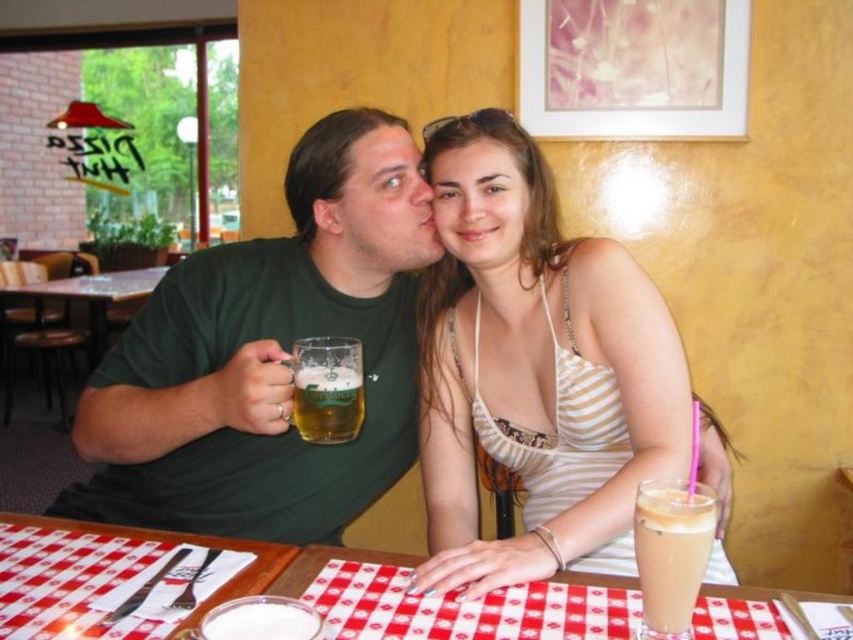
You are a photographer taking a photo of the scene. You want to focus on the green matte shirt at left and the white striped tank top at center. Which one is positioned lower in the frame?

The green matte shirt at left is located below the white striped tank top at center, so it is positioned lower in the frame.

You are a photographer trying to capture the couple in the scene. You need to place a small decorative item on the table that must fit entirely within the red checkered tablecloth at center without overlapping its edges. The item you want to place is as wide as the iced coffee at lower right. Will it fit?

The red checkered tablecloth at center is wider than the iced coffee at lower right, so placing an item with the same width as the iced coffee at lower right will fit within the tablecloth without overlapping its edges.